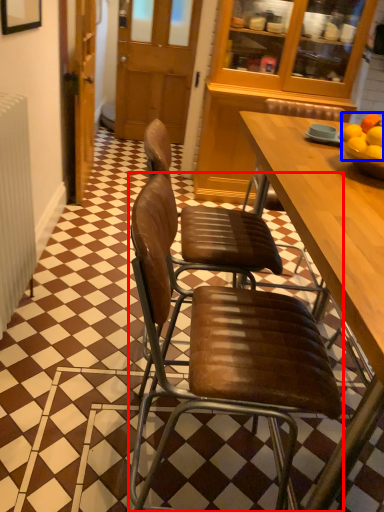
Question: Among these objects, which one is farthest to the camera, chair (highlighted by a red box) or fruit (highlighted by a blue box)?

Choices:
 (A) chair
 (B) fruit

Answer: (B)